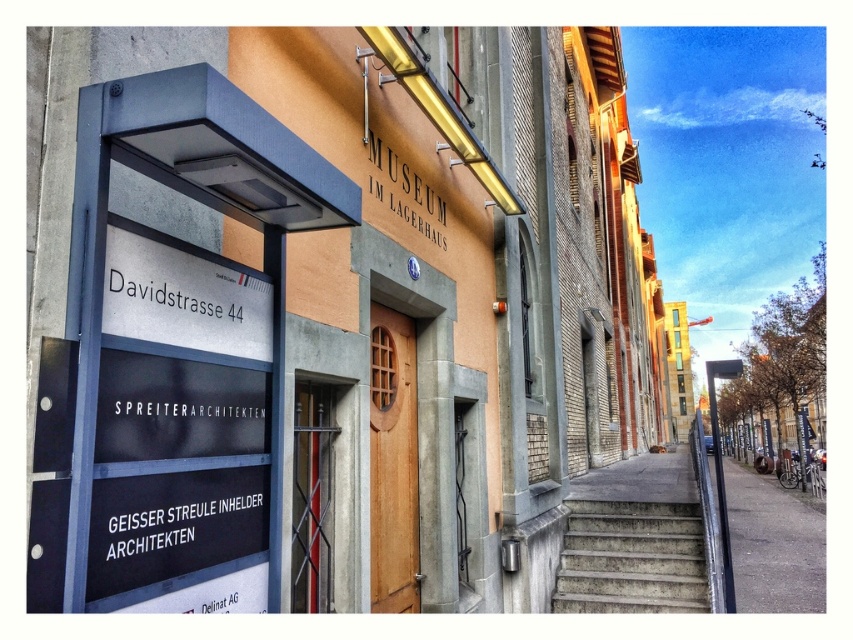
Can you confirm if black plastic sign at left is positioned above concrete stairs at lower right?

Correct, black plastic sign at left is located above concrete stairs at lower right.

Is the position of black plastic sign at left less distant than that of concrete stairs at lower right?

Yes, it is.

The height and width of the screenshot is (640, 853). I want to click on black plastic sign at left, so 178,413.

Locate an element on the screen. Image resolution: width=853 pixels, height=640 pixels. black plastic sign at left is located at coordinates [x=178, y=413].

Which is more to the left, concrete stairs at lower right or metallic pole at right?

Positioned to the left is concrete stairs at lower right.

Which is behind, point (621, 577) or point (717, 488)?

Point (621, 577)

Does point (595, 570) lie in front of point (726, 532)?

No, it is behind (726, 532).

Where is `concrete stairs at lower right`? concrete stairs at lower right is located at coordinates (631, 557).

Does black plastic sign at left have a lesser width compared to metallic pole at right?

Correct, black plastic sign at left's width is less than metallic pole at right's.

Who is taller, black plastic sign at left or metallic pole at right?

Standing taller between the two is metallic pole at right.

Identify the location of black plastic sign at left. (178, 413).